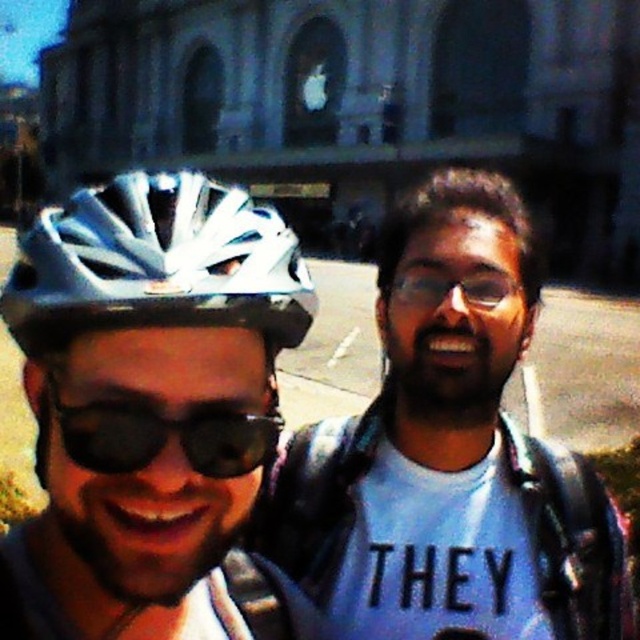
In the scene shown: You are standing in front of the classical building and see the point marked at coordinates (449,454). What object is located at that point?

The point at coordinates (449,454) indicates a matte black helmet at left.

You are a photographer setting up a shoot in front of a classical building with arched windows and columns. You have two props to place in the scene for a closeup shot. The props are the matte black helmet at left and the black reflective sunglasses at center. Which prop should you choose if you want to use the larger one to frame the subject?

The matte black helmet at left is larger in size than the black reflective sunglasses at center, so you should choose the matte black helmet at left to frame the subject.